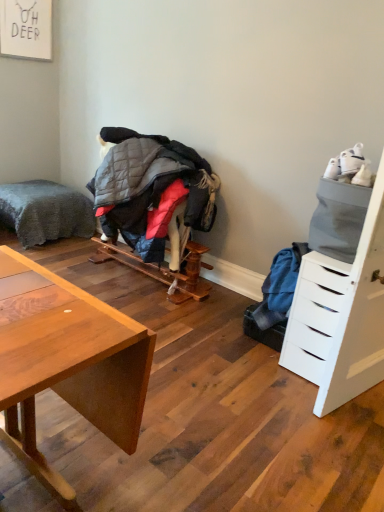
Locate an element on the screen. The image size is (384, 512). vacant space to the left of white matte drawer at right is located at coordinates (243, 360).